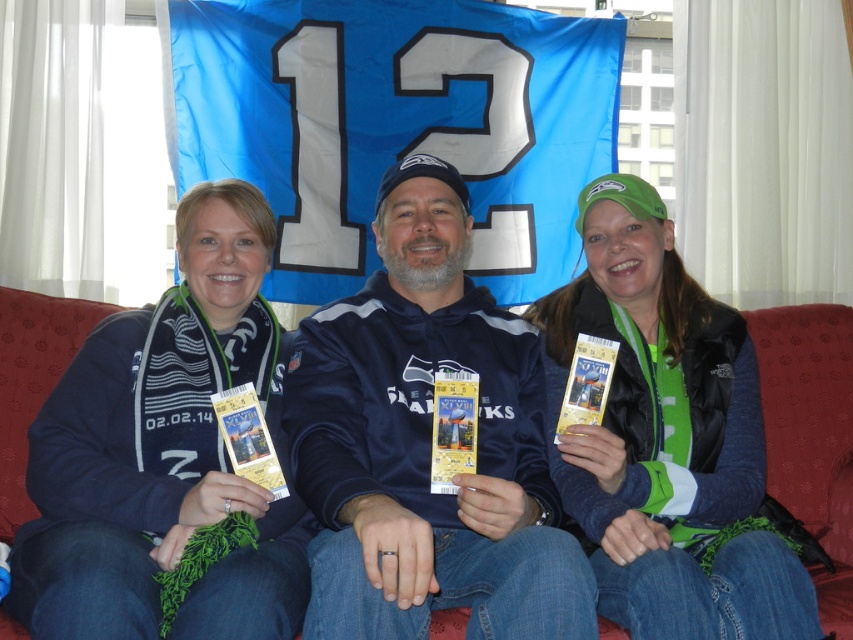
You are a photographer standing in front of the dark blue hoodie at center. You want to take a photo of the person wearing it without moving them. What is the minimum distance you need to maintain to ensure the entire person fits in your camera frame?

The minimum distance you need to maintain is 1.48 meters to ensure the entire person fits in your camera frame.

You are a photographer trying to take a group photo of the three people on the red couch. You want to ensure that both the dark blue fleece jacket at center and the green fabric vest at center are clearly visible in the photo. Based on their positions, which one should be moved slightly backward to achieve this?

The dark blue fleece jacket at center is in front of the green fabric vest at center. To ensure both are visible, the dark blue fleece jacket at center should be moved slightly backward so it doesn t block the green fabric vest at center.